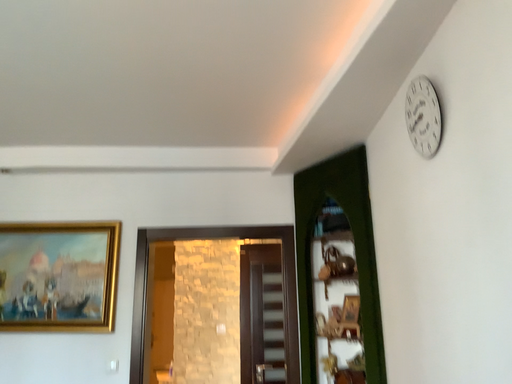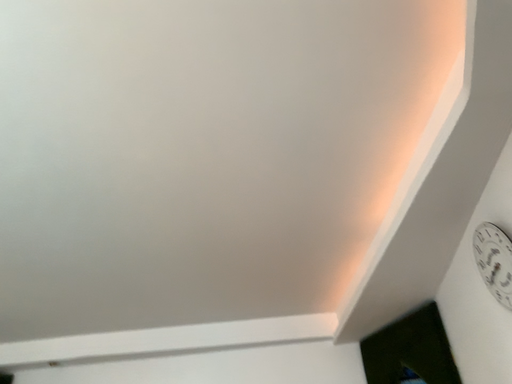
Question: Which way did the camera rotate in the video?

Choices:
 (A) rotated left
 (B) rotated right

Answer: (A)